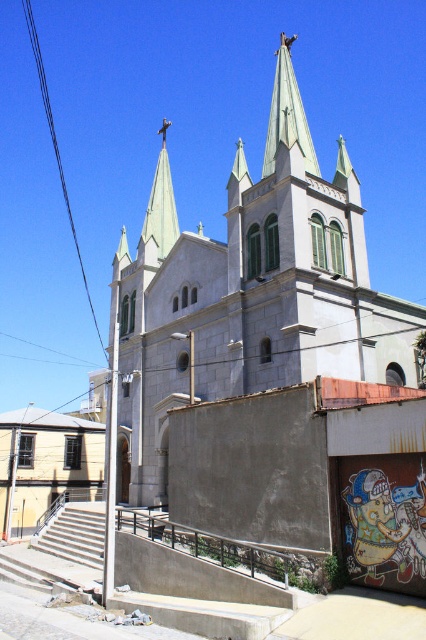
From the picture: You are standing at the bottom of the staircase in front of the church. You want to take a photo of the white stone church at center and the green metallic steeple at center. Which object should you focus on first if you want to capture both in one frame without moving the camera?

You should focus on the white stone church at center first because it is positioned under the green metallic steeple at center, so capturing the church will naturally include the steeple in the frame as it is above it.

You are standing at the base of the concrete staircase in front of the white stone church at center. Looking up, you notice the black wire at upper left. Which object is closer to the top of the image?

The black wire at upper left is closer to the top of the image because the white stone church at center is positioned under it.